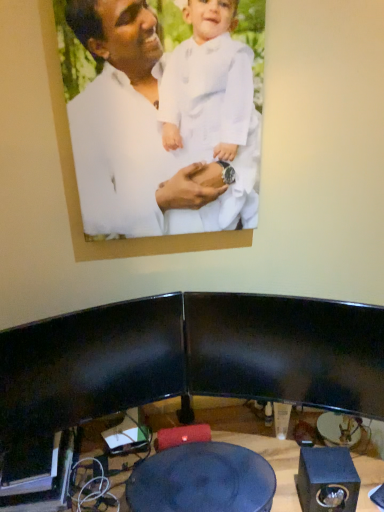
Question: Can you confirm if white matte picture frame at upper center is thinner than black matte speaker at lower right?

Choices:
 (A) no
 (B) yes

Answer: (B)

Question: Is white matte picture frame at upper center turned away from black matte speaker at lower right?

Choices:
 (A) no
 (B) yes

Answer: (A)

Question: Could you tell me if white matte picture frame at upper center is facing black matte speaker at lower right?

Choices:
 (A) yes
 (B) no

Answer: (B)

Question: Can you confirm if white matte picture frame at upper center is smaller than black matte speaker at lower right?

Choices:
 (A) no
 (B) yes

Answer: (A)

Question: Considering the relative sizes of white matte picture frame at upper center and black matte speaker at lower right in the image provided, is white matte picture frame at upper center wider than black matte speaker at lower right?

Choices:
 (A) no
 (B) yes

Answer: (A)

Question: In the image, is black matte speaker at lower right on the left side or the right side of blue glossy table at center?

Choices:
 (A) left
 (B) right

Answer: (B)

Question: Considering the positions of black matte speaker at lower right and blue glossy table at center in the image, is black matte speaker at lower right taller or shorter than blue glossy table at center?

Choices:
 (A) tall
 (B) short

Answer: (A)

Question: From the image's perspective, is black matte speaker at lower right above or below blue glossy table at center?

Choices:
 (A) above
 (B) below

Answer: (A)

Question: Is black matte speaker at lower right inside or outside of blue glossy table at center?

Choices:
 (A) outside
 (B) inside

Answer: (A)

Question: From the image's perspective, is white matte picture frame at upper center positioned above or below blue glossy table at center?

Choices:
 (A) below
 (B) above

Answer: (B)

Question: Is white matte picture frame at upper center in front of or behind blue glossy table at center in the image?

Choices:
 (A) behind
 (B) front

Answer: (B)

Question: From their relative heights in the image, would you say white matte picture frame at upper center is taller or shorter than blue glossy table at center?

Choices:
 (A) short
 (B) tall

Answer: (B)

Question: From a real-world perspective, is white matte picture frame at upper center positioned above or below blue glossy table at center?

Choices:
 (A) above
 (B) below

Answer: (A)

Question: In the image, is black matte speaker at lower right positioned in front of or behind white matte picture frame at upper center?

Choices:
 (A) front
 (B) behind

Answer: (B)

Question: Visually, is black matte speaker at lower right positioned to the left or to the right of white matte picture frame at upper center?

Choices:
 (A) left
 (B) right

Answer: (B)